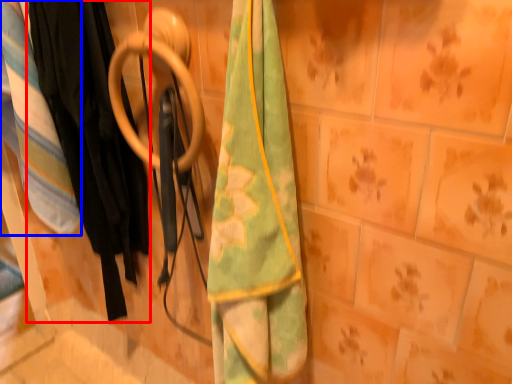
Question: Which of the following is the farthest to the observer, clothing (highlighted by a red box) or blanket (highlighted by a blue box)?

Choices:
 (A) clothing
 (B) blanket

Answer: (B)